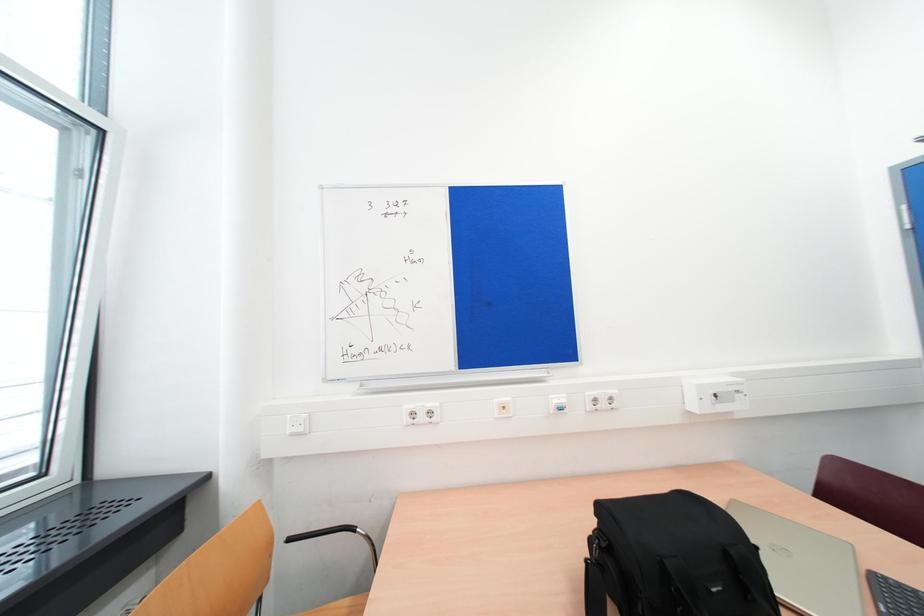
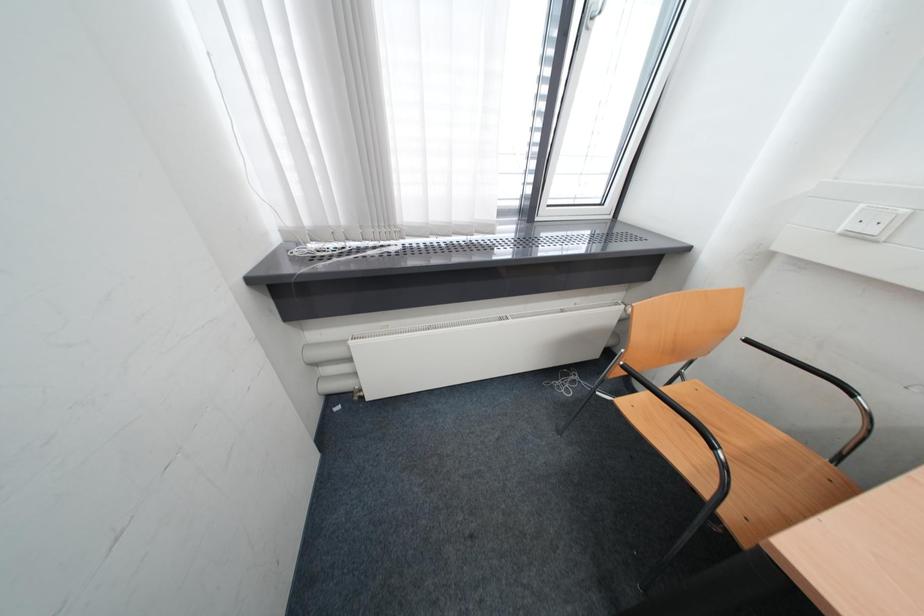
How did the camera likely rotate?

The camera's rotation is toward left-down.